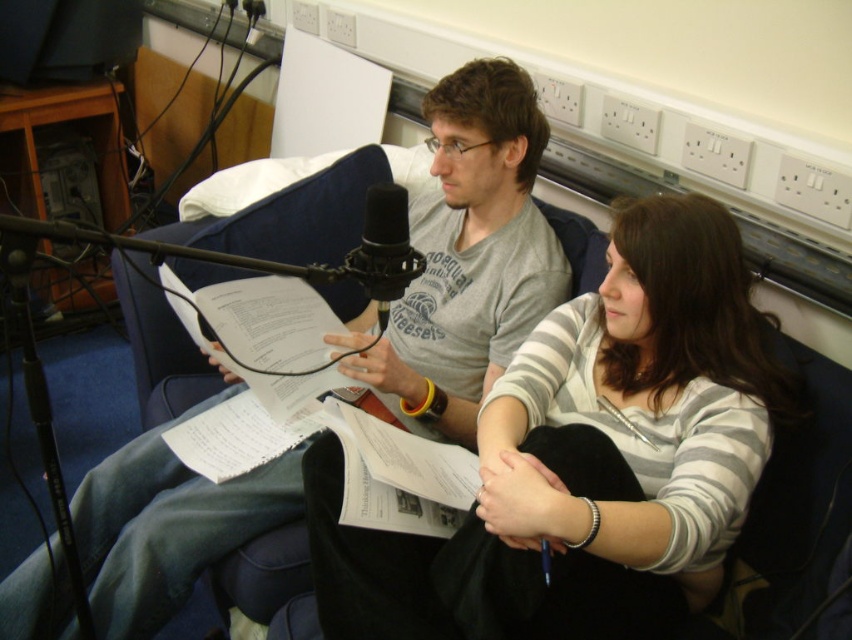
You are a photographer who needs to adjust the lighting for a photo shoot. You have to decide whether to place a spotlight closer to the striped cotton sweater at center or the black foam microphone at center. Based on their positions, which object is closer to you and should receive more direct light?

The striped cotton sweater at center is closer to you than the black foam microphone at center, so the spotlight should be placed closer to the striped cotton sweater at center to ensure it receives more direct light.